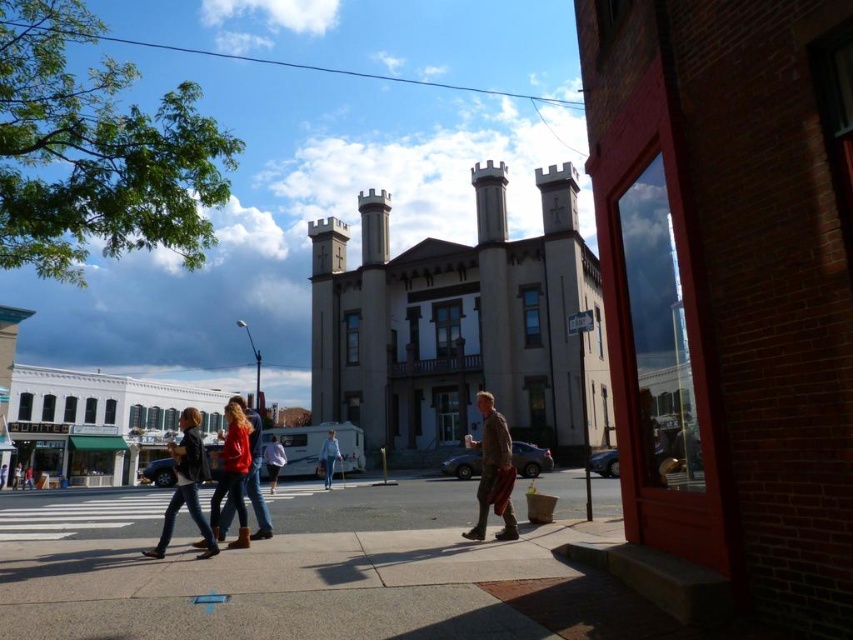
You are standing on the sidewalk in front of the historic building. You see two points marked on the ground. One is at coordinate point(374, 506) and the other at point(27, 484). Which point is closer to you?

The point at coordinate point(374, 506) is closer to you than the point at point(27, 484).

You are standing on the gray concrete sidewalk at lower center and want to reach the denim jacket at center. Which direction should you move to get there?

The gray concrete sidewalk at lower center is to the right of the denim jacket at center, so to reach it, you should move to the left.